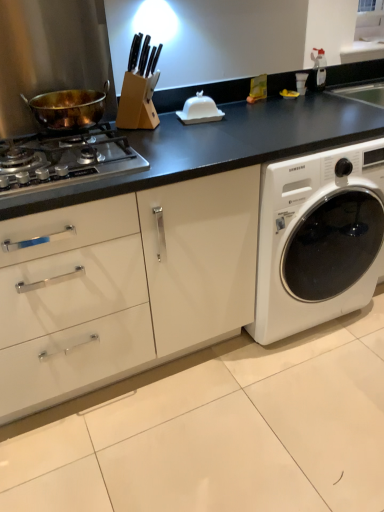
Question: From a real-world perspective, is stainless steel gas stove at left physically above white matte washing machine at center-right?

Choices:
 (A) no
 (B) yes

Answer: (B)

Question: Considering the relative sizes of stainless steel gas stove at left and white matte washing machine at center-right in the image provided, is stainless steel gas stove at left wider than white matte washing machine at center-right?

Choices:
 (A) no
 (B) yes

Answer: (A)

Question: Is white matte washing machine at center-right at the back of stainless steel gas stove at left?

Choices:
 (A) no
 (B) yes

Answer: (A)

Question: Is stainless steel gas stove at left aimed at white matte washing machine at center-right?

Choices:
 (A) yes
 (B) no

Answer: (B)

Question: Does stainless steel gas stove at left come behind white matte washing machine at center-right?

Choices:
 (A) no
 (B) yes

Answer: (A)

Question: From the image's perspective, is stainless steel gas stove at left on top of white matte washing machine at center-right?

Choices:
 (A) yes
 (B) no

Answer: (A)

Question: Can you see gold-bronze wok at left touching stainless steel gas stove at left?

Choices:
 (A) no
 (B) yes

Answer: (A)

Question: Does gold-bronze wok at left turn towards stainless steel gas stove at left?

Choices:
 (A) yes
 (B) no

Answer: (B)

Question: Does gold-bronze wok at left have a lesser width compared to stainless steel gas stove at left?

Choices:
 (A) no
 (B) yes

Answer: (B)

Question: Is gold-bronze wok at left taller than stainless steel gas stove at left?

Choices:
 (A) yes
 (B) no

Answer: (A)

Question: Is gold-bronze wok at left wider than stainless steel gas stove at left?

Choices:
 (A) no
 (B) yes

Answer: (A)

Question: Is gold-bronze wok at left at the right side of stainless steel gas stove at left?

Choices:
 (A) no
 (B) yes

Answer: (B)

Question: From the image's perspective, is white glossy butter dish at center on top of white matte washing machine at center-right?

Choices:
 (A) no
 (B) yes

Answer: (B)